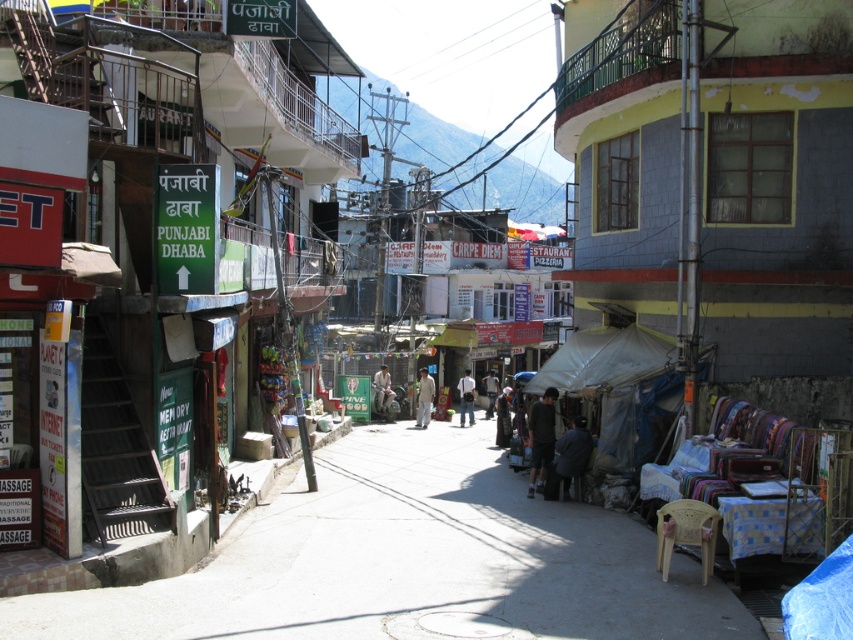
Question: Which of the following is the farthest from the observer?

Choices:
 (A) dark gray fabric at center
 (B) dark gray shirt at center
 (C) light brown leather jacket at center
 (D) light brown fabric pants at center

Answer: (D)

Question: Is dark blue fabric at center closer to camera compared to light brown fabric pants at center?

Choices:
 (A) no
 (B) yes

Answer: (B)

Question: Which of these objects is positioned farthest from the plastic chair at center?

Choices:
 (A) light brown fabric pants at center
 (B) dark gray shirt at center
 (C) dark blue fabric at center
 (D) dark gray fabric at center

Answer: (A)

Question: Can you confirm if dark gray fabric at center is positioned above light brown fabric pants at center?

Choices:
 (A) no
 (B) yes

Answer: (A)

Question: Does dark blue fabric at lower right lie in front of dark blue fabric at center?

Choices:
 (A) yes
 (B) no

Answer: (A)

Question: Which object is farther from the camera taking this photo?

Choices:
 (A) dark blue fabric at center
 (B) dark gray fabric at center
 (C) dark gray shirt at center
 (D) light beige fabric jacket at center

Answer: (C)